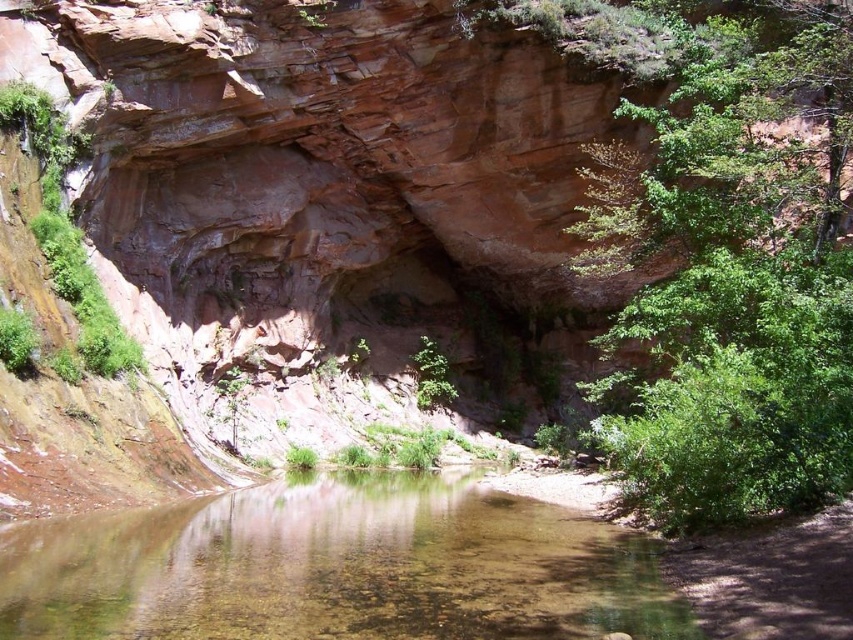
You are standing on the rocky cliff face and want to look at both the green leafy tree at right and the clear water at center. Which object will appear taller from your viewpoint?

The green leafy tree at right is taller than the clear water at center, so it will appear taller from your viewpoint on the rocky cliff face.

Looking at this image, you are standing at the edge of the cliff and want to take a photo of the green leafy tree at right and the clear water at center. Which object should you focus on first if you want to capture both in a single frame without moving the camera?

The green leafy tree at right is larger in size compared to the clear water at center, so you should focus on the green leafy tree at right first to ensure it fits properly in the frame.

You are standing at the point closer to the water in the scene. There are two points marked in the image, one at point coordinates [625,108] and another at [219,506]. Which point is farther away from you?

Point [625,108] is behind point [219,506], so the point at [625,108] is farther away from you.